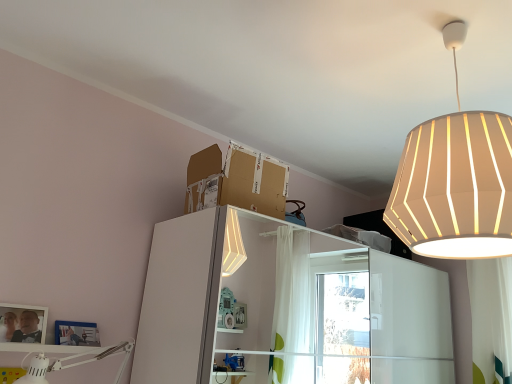
This screenshot has width=512, height=384. In order to click on empty space that is ontop of white fabric lampshade at upper right, placed as the second lamp when sorted from bottom to top (from a real-world perspective) in this screenshot , I will do `click(446, 31)`.